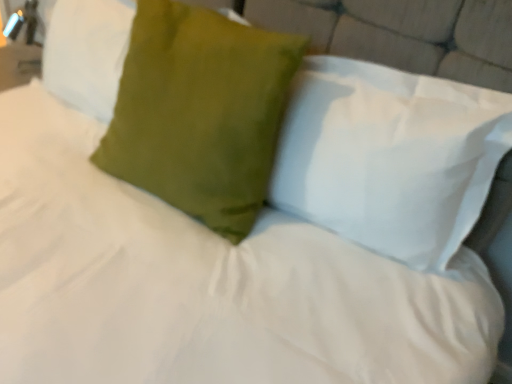
Question: Is matte green pillow at upper center, the first pillow in the right-to-left sequence, wider than satin green pillow at upper left, which is the third pillow in right-to-left order?

Choices:
 (A) yes
 (B) no

Answer: (A)

Question: From the image's perspective, would you say matte green pillow at upper center, which appears as the third pillow when viewed from the left, is shown under satin green pillow at upper left, which is the third pillow in right-to-left order?

Choices:
 (A) no
 (B) yes

Answer: (B)

Question: Is matte green pillow at upper center, the first pillow in the right-to-left sequence, located outside satin green pillow at upper left, the 1th pillow from the left?

Choices:
 (A) no
 (B) yes

Answer: (B)

Question: Would you say satin green pillow at upper left, the 1th pillow from the left, is part of matte green pillow at upper center, the first pillow in the right-to-left sequence,'s contents?

Choices:
 (A) no
 (B) yes

Answer: (A)

Question: Does matte green pillow at upper center, which appears as the third pillow when viewed from the left, come in front of satin green pillow at upper left, which is the third pillow in right-to-left order?

Choices:
 (A) yes
 (B) no

Answer: (A)

Question: Considering the relative sizes of matte green pillow at upper center, the first pillow in the right-to-left sequence, and satin green pillow at upper left, the 1th pillow from the left, in the image provided, is matte green pillow at upper center, the first pillow in the right-to-left sequence, taller than satin green pillow at upper left, the 1th pillow from the left,?

Choices:
 (A) no
 (B) yes

Answer: (B)

Question: Considering the relative positions of satin green pillow at upper left, which is the third pillow in right-to-left order, and matte green pillow at upper center, which appears as the third pillow when viewed from the left, in the image provided, is satin green pillow at upper left, which is the third pillow in right-to-left order, to the left of matte green pillow at upper center, which appears as the third pillow when viewed from the left, from the viewer's perspective?

Choices:
 (A) yes
 (B) no

Answer: (A)

Question: Considering the relative sizes of satin green pillow at upper left, the 1th pillow from the left, and matte green pillow at upper center, which appears as the third pillow when viewed from the left, in the image provided, is satin green pillow at upper left, the 1th pillow from the left, wider than matte green pillow at upper center, which appears as the third pillow when viewed from the left,?

Choices:
 (A) no
 (B) yes

Answer: (A)

Question: From the image's perspective, is satin green pillow at upper left, the 1th pillow from the left, below matte green pillow at upper center, which appears as the third pillow when viewed from the left?

Choices:
 (A) yes
 (B) no

Answer: (B)

Question: Is matte green pillow at upper center, the first pillow in the right-to-left sequence, at the back of satin green pillow at upper left, the 1th pillow from the left?

Choices:
 (A) yes
 (B) no

Answer: (B)

Question: From a real-world perspective, is satin green pillow at upper left, the 1th pillow from the left, below matte green pillow at upper center, which appears as the third pillow when viewed from the left?

Choices:
 (A) yes
 (B) no

Answer: (A)

Question: Is satin green pillow at upper left, which is the third pillow in right-to-left order, far from matte green pillow at upper center, which appears as the third pillow when viewed from the left?

Choices:
 (A) yes
 (B) no

Answer: (B)

Question: Is matte green pillow at upper center, which appears as the third pillow when viewed from the left, positioned before satin green pillow at center, which ranks as the second pillow in right-to-left order?

Choices:
 (A) no
 (B) yes

Answer: (B)